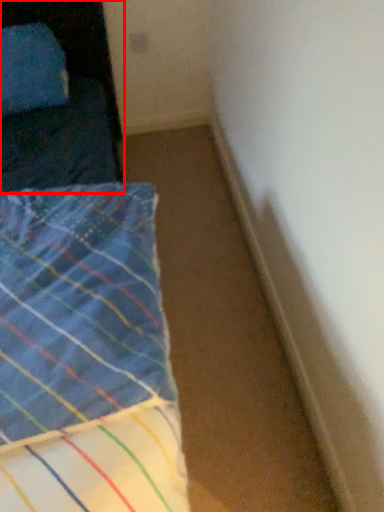
Question: From the image's perspective, considering the relative positions of furniture (annotated by the red box) and bed in the image provided, where is furniture (annotated by the red box) located with respect to the staircase?

Choices:
 (A) above
 (B) below

Answer: (A)